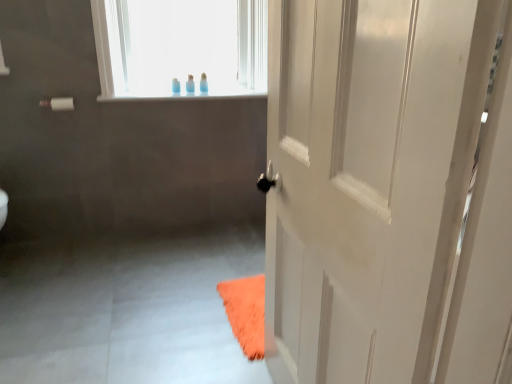
Question: Is white matte towel bar at upper left next to translucent plastic toothbrush at upper center, which is the first toiletry from right to left, and touching it?

Choices:
 (A) no
 (B) yes

Answer: (A)

Question: Is white matte towel bar at upper left facing towards translucent plastic toothbrush at upper center, the second toiletry in the left-to-right sequence?

Choices:
 (A) yes
 (B) no

Answer: (B)

Question: Is translucent plastic toothbrush at upper center, which is the first toiletry from right to left, completely or partially inside white matte towel bar at upper left?

Choices:
 (A) yes
 (B) no

Answer: (B)

Question: Considering the relative sizes of white matte towel bar at upper left and translucent plastic toothbrush at upper center, the second toiletry in the left-to-right sequence, in the image provided, is white matte towel bar at upper left thinner than translucent plastic toothbrush at upper center, the second toiletry in the left-to-right sequence,?

Choices:
 (A) yes
 (B) no

Answer: (B)

Question: Is white matte towel bar at upper left not inside translucent plastic toothbrush at upper center, which is the first toiletry from right to left?

Choices:
 (A) yes
 (B) no

Answer: (A)

Question: Is white matte towel bar at upper left to the left of translucent plastic toothbrush at upper center, which is the first toiletry from right to left, from the viewer's perspective?

Choices:
 (A) no
 (B) yes

Answer: (B)

Question: From a real-world perspective, is white matte towel bar at upper left on top of translucent plastic bottle at upper center, the 1th toiletry from the left?

Choices:
 (A) yes
 (B) no

Answer: (B)

Question: From the image's perspective, is white matte towel bar at upper left beneath translucent plastic bottle at upper center, marked as the second toiletry in a right-to-left arrangement?

Choices:
 (A) yes
 (B) no

Answer: (A)

Question: Does white matte towel bar at upper left appear on the left side of translucent plastic bottle at upper center, marked as the second toiletry in a right-to-left arrangement?

Choices:
 (A) yes
 (B) no

Answer: (A)

Question: From a real-world perspective, is white matte towel bar at upper left physically below translucent plastic bottle at upper center, the 1th toiletry from the left?

Choices:
 (A) yes
 (B) no

Answer: (A)

Question: Can you confirm if white matte towel bar at upper left is smaller than translucent plastic bottle at upper center, marked as the second toiletry in a right-to-left arrangement?

Choices:
 (A) yes
 (B) no

Answer: (B)

Question: Considering the relative sizes of white matte towel bar at upper left and translucent plastic bottle at upper center, marked as the second toiletry in a right-to-left arrangement, in the image provided, is white matte towel bar at upper left bigger than translucent plastic bottle at upper center, marked as the second toiletry in a right-to-left arrangement,?

Choices:
 (A) no
 (B) yes

Answer: (B)

Question: Considering the relative sizes of translucent plastic toothbrush at upper center, the second toiletry in the left-to-right sequence, and white glossy door at right in the image provided, is translucent plastic toothbrush at upper center, the second toiletry in the left-to-right sequence, wider than white glossy door at right?

Choices:
 (A) yes
 (B) no

Answer: (B)